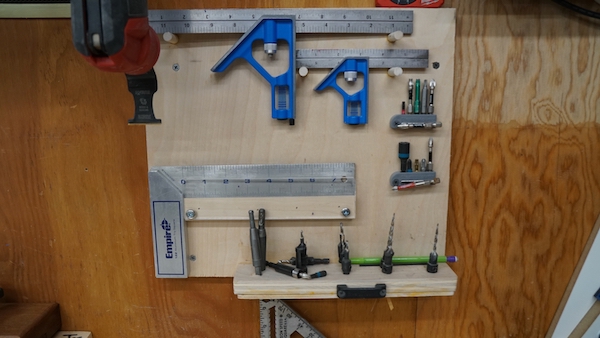
Identify the location of stair. The height and width of the screenshot is (338, 600). (22, 316).